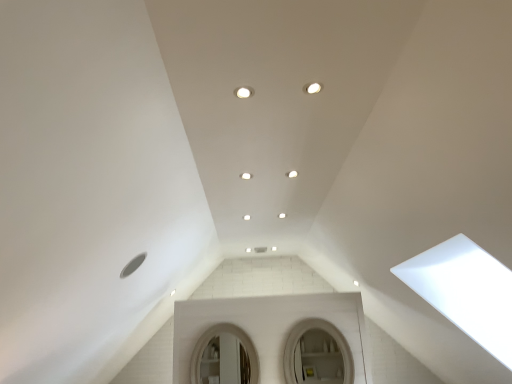
Where is `white matte mirror at center, arranged as the 2th mirror when viewed from the right`? This screenshot has height=384, width=512. white matte mirror at center, arranged as the 2th mirror when viewed from the right is located at coordinates (218, 334).

Describe the element at coordinates (317, 354) in the screenshot. I see `white glossy mirror at center, the second mirror in the left-to-right sequence` at that location.

What are the coordinates of `white glossy mirror at center, positioned as the 1th mirror in right-to-left order` in the screenshot? It's located at (317, 354).

Measure the distance between point (286, 173) and camera.

Point (286, 173) is 2.88 meters from camera.

Find the location of `white matte mirror at center, which is counted as the first mirror, starting from the left`. white matte mirror at center, which is counted as the first mirror, starting from the left is located at coordinates (218, 334).

Can you confirm if white glossy light fixture at center is bigger than white matte mirror at center, arranged as the 2th mirror when viewed from the right?

No.

In terms of width, does white glossy light fixture at center look wider or thinner when compared to white matte mirror at center, arranged as the 2th mirror when viewed from the right?

Clearly, white glossy light fixture at center has more width compared to white matte mirror at center, arranged as the 2th mirror when viewed from the right.

Which is more distant, (293,177) or (193,366)?

The point (193,366) is more distant.

The width and height of the screenshot is (512, 384). There is a white glossy mirror at center, positioned as the 1th mirror in right-to-left order. In order to click on mirror above it (from a real-world perspective) in this screenshot , I will do `click(218, 334)`.

From the image's perspective, is white glossy mirror at center, the second mirror in the left-to-right sequence, under white matte mirror at center, which is counted as the first mirror, starting from the left?

No, from the image's perspective, white glossy mirror at center, the second mirror in the left-to-right sequence, is not below white matte mirror at center, which is counted as the first mirror, starting from the left.

Measure the distance from white glossy mirror at center, the second mirror in the left-to-right sequence, to white matte mirror at center, arranged as the 2th mirror when viewed from the right.

white glossy mirror at center, the second mirror in the left-to-right sequence, and white matte mirror at center, arranged as the 2th mirror when viewed from the right, are 23.36 inches apart from each other.

Is the position of white glossy mirror at center, positioned as the 1th mirror in right-to-left order, less distant than that of white matte mirror at center, which is counted as the first mirror, starting from the left?

That is True.

Would you say white glossy mirror at center, positioned as the 1th mirror in right-to-left order, is outside white glossy light fixture at center?

Absolutely, white glossy mirror at center, positioned as the 1th mirror in right-to-left order, is external to white glossy light fixture at center.

Which object is thinner, white glossy mirror at center, positioned as the 1th mirror in right-to-left order, or white glossy light fixture at center?

With smaller width is white glossy mirror at center, positioned as the 1th mirror in right-to-left order.

Is white glossy mirror at center, the second mirror in the left-to-right sequence, bigger than white glossy light fixture at center?

Yes, white glossy mirror at center, the second mirror in the left-to-right sequence, is bigger than white glossy light fixture at center.

Is white glossy light fixture at center at the back of white glossy mirror at center, positioned as the 1th mirror in right-to-left order?

No, white glossy mirror at center, positioned as the 1th mirror in right-to-left order, is not facing away from white glossy light fixture at center.

Which of these two, white matte mirror at center, arranged as the 2th mirror when viewed from the right, or white glossy mirror at center, positioned as the 1th mirror in right-to-left order, is thinner?

white matte mirror at center, arranged as the 2th mirror when viewed from the right.

Is white glossy mirror at center, positioned as the 1th mirror in right-to-left order, at the back of white matte mirror at center, arranged as the 2th mirror when viewed from the right?

No, white matte mirror at center, arranged as the 2th mirror when viewed from the right, is not facing the opposite direction of white glossy mirror at center, positioned as the 1th mirror in right-to-left order.

Which is correct: white matte mirror at center, arranged as the 2th mirror when viewed from the right, is inside white glossy mirror at center, the second mirror in the left-to-right sequence, or outside of it?

white matte mirror at center, arranged as the 2th mirror when viewed from the right, exists outside the volume of white glossy mirror at center, the second mirror in the left-to-right sequence.

Can you see white matte mirror at center, which is counted as the first mirror, starting from the left, touching white glossy mirror at center, positioned as the 1th mirror in right-to-left order?

They are not placed beside each other.

From a real-world perspective, who is located lower, white matte mirror at center, which is counted as the first mirror, starting from the left, or white glossy light fixture at center?

From a 3D spatial view, white matte mirror at center, which is counted as the first mirror, starting from the left, is below.

Which of these two, white matte mirror at center, arranged as the 2th mirror when viewed from the right, or white glossy light fixture at center, stands shorter?

white glossy light fixture at center is shorter.

Looking at this image, from the image's perspective, would you say white matte mirror at center, arranged as the 2th mirror when viewed from the right, is positioned over white glossy light fixture at center?

No, from the image's perspective, white matte mirror at center, arranged as the 2th mirror when viewed from the right, is not over white glossy light fixture at center.

How different are the orientations of white matte mirror at center, which is counted as the first mirror, starting from the left, and white glossy light fixture at center in degrees?

The angular difference between white matte mirror at center, which is counted as the first mirror, starting from the left, and white glossy light fixture at center is 3.45 degrees.

From a real-world perspective, which object stands above the other?

white glossy light fixture at center is physically above.

Is white glossy light fixture at center in front of white glossy mirror at center, the second mirror in the left-to-right sequence?

Yes, white glossy light fixture at center is closer to the camera.

What's the angular difference between white glossy light fixture at center and white glossy mirror at center, the second mirror in the left-to-right sequence,'s facing directions?

The angle between the facing direction of white glossy light fixture at center and the facing direction of white glossy mirror at center, the second mirror in the left-to-right sequence, is 3.45 degrees.

In the scene shown: Is white glossy light fixture at center bigger than white glossy mirror at center, positioned as the 1th mirror in right-to-left order?

Incorrect, white glossy light fixture at center is not larger than white glossy mirror at center, positioned as the 1th mirror in right-to-left order.

This screenshot has height=384, width=512. I want to click on lighting in front of the white matte mirror at center, which is counted as the first mirror, starting from the left, so click(x=292, y=174).

In the image, there is a white matte mirror at center, which is counted as the first mirror, starting from the left. At what (x,y) coordinates should I click in order to perform the action: click on mirror above it (from the image's perspective). Please return your answer as a coordinate pair (x, y). Looking at the image, I should click on (317, 354).

Looking at the image, which one is located further to white glossy mirror at center, positioned as the 1th mirror in right-to-left order, white glossy light fixture at center or white matte mirror at center, arranged as the 2th mirror when viewed from the right?

The object further to white glossy mirror at center, positioned as the 1th mirror in right-to-left order, is white glossy light fixture at center.

Considering their positions, is white glossy light fixture at center positioned further to white matte mirror at center, arranged as the 2th mirror when viewed from the right, than white glossy mirror at center, the second mirror in the left-to-right sequence?

white glossy light fixture at center is positioned further to the anchor white matte mirror at center, arranged as the 2th mirror when viewed from the right.

Considering their positions, is white glossy mirror at center, positioned as the 1th mirror in right-to-left order, positioned further to white matte mirror at center, which is counted as the first mirror, starting from the left, than white glossy light fixture at center?

Among the two, white glossy light fixture at center is located further to white matte mirror at center, which is counted as the first mirror, starting from the left.

Considering their positions, is white matte mirror at center, which is counted as the first mirror, starting from the left, positioned further to white glossy mirror at center, the second mirror in the left-to-right sequence, than white glossy light fixture at center?

Based on the image, white glossy light fixture at center appears to be further to white glossy mirror at center, the second mirror in the left-to-right sequence.

When comparing their distances from white glossy light fixture at center, does white glossy mirror at center, positioned as the 1th mirror in right-to-left order, or white matte mirror at center, arranged as the 2th mirror when viewed from the right, seem further?

white matte mirror at center, arranged as the 2th mirror when viewed from the right.

Which object lies further to the anchor point white glossy light fixture at center, white matte mirror at center, arranged as the 2th mirror when viewed from the right, or white glossy mirror at center, the second mirror in the left-to-right sequence?

white matte mirror at center, arranged as the 2th mirror when viewed from the right, is further to white glossy light fixture at center.

Where is `mirror between white glossy light fixture at center and white matte mirror at center, which is counted as the first mirror, starting from the left, vertically`? mirror between white glossy light fixture at center and white matte mirror at center, which is counted as the first mirror, starting from the left, vertically is located at coordinates (317, 354).